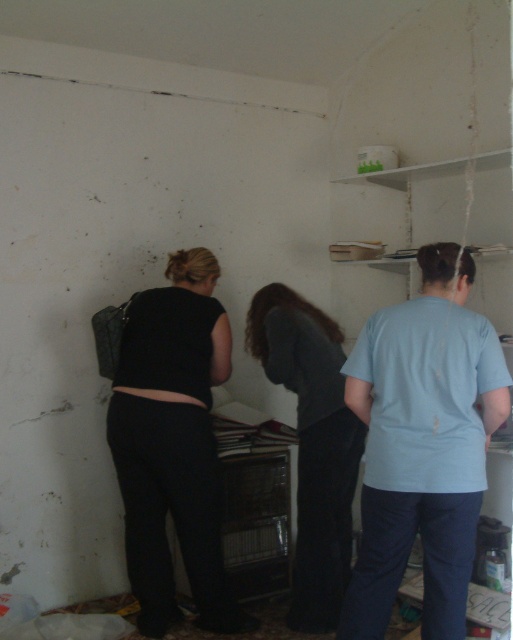
Can you confirm if light blue t-shirt at center is smaller than dark gray fabric at center?

Correct, light blue t-shirt at center occupies less space than dark gray fabric at center.

Is light blue t-shirt at center closer to the viewer compared to dark gray fabric at center?

Yes, light blue t-shirt at center is closer to the viewer.

Measure the distance between point (388, 515) and camera.

They are 2.34 meters apart.

I want to click on light blue t-shirt at center, so click(423, 444).

Is light blue t-shirt at center further to camera compared to black matte pants at center?

No, it is in front of black matte pants at center.

The width and height of the screenshot is (513, 640). I want to click on light blue t-shirt at center, so click(423, 444).

Locate an element on the screen. light blue t-shirt at center is located at coordinates (423, 444).

Is point (167, 621) behind point (263, 321)?

No, it is in front of (263, 321).

Is point (145, 385) more distant than point (291, 372)?

That is False.

Image resolution: width=513 pixels, height=640 pixels. In order to click on black matte pants at center in this screenshot , I will do `click(172, 444)`.